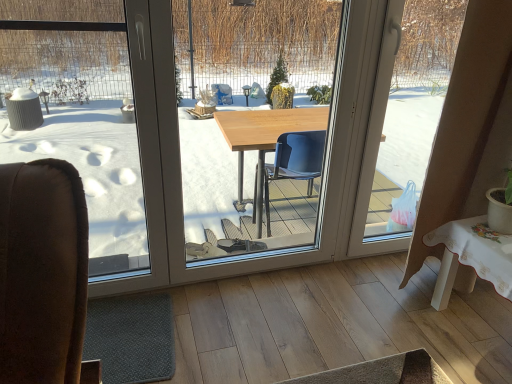
Describe the element at coordinates (78, 114) in the screenshot. This screenshot has height=384, width=512. I see `transparent glass window at left, the 1th window screen when ordered from left to right` at that location.

This screenshot has width=512, height=384. What are the coordinates of `gray rubber mat at lower left` in the screenshot? It's located at (131, 338).

Locate an element on the screen. The image size is (512, 384). transparent glass window at left, the 1th window screen when ordered from left to right is located at coordinates (78, 114).

Is gray rubber mat at lower left shorter than wooden table at center, acting as the second window screen starting from the left?

Yes, gray rubber mat at lower left is shorter than wooden table at center, acting as the second window screen starting from the left.

From a real-world perspective, is gray rubber mat at lower left below wooden table at center, acting as the second window screen starting from the left?

Yes, from a real-world perspective, gray rubber mat at lower left is beneath wooden table at center, acting as the second window screen starting from the left.

Is gray rubber mat at lower left surrounding wooden table at center, acting as the second window screen starting from the left?

No, wooden table at center, acting as the second window screen starting from the left, is not surrounded by gray rubber mat at lower left.

Considering the sizes of objects gray rubber mat at lower left and wooden table at center, arranged as the 2th window screen when viewed from the right, in the image provided, who is thinner, gray rubber mat at lower left or wooden table at center, arranged as the 2th window screen when viewed from the right,?

wooden table at center, arranged as the 2th window screen when viewed from the right.

Considering the positions of objects gray rubber mat at lower left and transparent plastic bag at right, which is the first window screen in right-to-left order, in the image provided, who is behind, gray rubber mat at lower left or transparent plastic bag at right, which is the first window screen in right-to-left order,?

transparent plastic bag at right, which is the first window screen in right-to-left order, is further away from the camera.

Who is bigger, gray rubber mat at lower left or transparent plastic bag at right, which is the first window screen in right-to-left order?

With larger size is transparent plastic bag at right, which is the first window screen in right-to-left order.

Which is more to the left, gray rubber mat at lower left or transparent plastic bag at right, the third window screen when ordered from left to right?

gray rubber mat at lower left.

From a real-world perspective, which object stands above the other?

transparent plastic bag at right, which is the first window screen in right-to-left order.

Based on the photo, how different are the orientations of transparent glass window at left, the 3th window screen positioned from the right, and wooden table at center, acting as the second window screen starting from the left, in degrees?

0.00145 degrees.

Looking at this image, between transparent glass window at left, the 1th window screen when ordered from left to right, and wooden table at center, arranged as the 2th window screen when viewed from the right, which one has larger width?

With larger width is transparent glass window at left, the 1th window screen when ordered from left to right.

From their relative heights in the image, would you say transparent glass window at left, the 1th window screen when ordered from left to right, is taller or shorter than wooden table at center, acting as the second window screen starting from the left?

Considering their sizes, transparent glass window at left, the 1th window screen when ordered from left to right, has less height than wooden table at center, acting as the second window screen starting from the left.

Is wooden table at center, arranged as the 2th window screen when viewed from the right, bigger or smaller than transparent plastic bag at right, the third window screen when ordered from left to right?

Clearly, wooden table at center, arranged as the 2th window screen when viewed from the right, is smaller in size than transparent plastic bag at right, the third window screen when ordered from left to right.

In the scene shown: From the image's perspective, which one is positioned lower, wooden table at center, arranged as the 2th window screen when viewed from the right, or transparent plastic bag at right, which is the first window screen in right-to-left order?

wooden table at center, arranged as the 2th window screen when viewed from the right.

Which of these two, wooden table at center, arranged as the 2th window screen when viewed from the right, or transparent plastic bag at right, the third window screen when ordered from left to right, is wider?

transparent plastic bag at right, the third window screen when ordered from left to right, is wider.

From a real-world perspective, is transparent plastic bag at right, which is the first window screen in right-to-left order, beneath transparent glass window at left, the 3th window screen positioned from the right?

No, from a real-world perspective, transparent plastic bag at right, which is the first window screen in right-to-left order, is not beneath transparent glass window at left, the 3th window screen positioned from the right.

Consider the image. Could you tell me if transparent plastic bag at right, which is the first window screen in right-to-left order, is facing transparent glass window at left, the 1th window screen when ordered from left to right?

No, transparent plastic bag at right, which is the first window screen in right-to-left order, is not aimed at transparent glass window at left, the 1th window screen when ordered from left to right.

Considering the sizes of objects transparent plastic bag at right, the third window screen when ordered from left to right, and transparent glass window at left, the 3th window screen positioned from the right, in the image provided, who is bigger, transparent plastic bag at right, the third window screen when ordered from left to right, or transparent glass window at left, the 3th window screen positioned from the right,?

With larger size is transparent glass window at left, the 3th window screen positioned from the right.

Can you confirm if transparent plastic bag at right, the third window screen when ordered from left to right, is shorter than transparent glass window at left, the 3th window screen positioned from the right?

No.

Could you tell me if wooden table at center, arranged as the 2th window screen when viewed from the right, is facing transparent glass window at left, the 1th window screen when ordered from left to right?

No.

Would you consider wooden table at center, arranged as the 2th window screen when viewed from the right, to be distant from transparent glass window at left, the 3th window screen positioned from the right?

Yes, wooden table at center, arranged as the 2th window screen when viewed from the right, is far from transparent glass window at left, the 3th window screen positioned from the right.

From a real-world perspective, between wooden table at center, acting as the second window screen starting from the left, and transparent glass window at left, the 3th window screen positioned from the right, who is vertically higher?

wooden table at center, acting as the second window screen starting from the left.

Can you confirm if transparent glass window at left, the 1th window screen when ordered from left to right, is shorter than gray rubber mat at lower left?

No, transparent glass window at left, the 1th window screen when ordered from left to right, is not shorter than gray rubber mat at lower left.

Is transparent glass window at left, the 3th window screen positioned from the right, wider than gray rubber mat at lower left?

Incorrect, the width of transparent glass window at left, the 3th window screen positioned from the right, does not surpass that of gray rubber mat at lower left.

Is transparent glass window at left, the 3th window screen positioned from the right, directly adjacent to gray rubber mat at lower left?

There is a gap between transparent glass window at left, the 3th window screen positioned from the right, and gray rubber mat at lower left.

Is transparent glass window at left, the 3th window screen positioned from the right, looking in the opposite direction of gray rubber mat at lower left?

transparent glass window at left, the 3th window screen positioned from the right, is not turned away from gray rubber mat at lower left.

Find the location of a particular element. the 1st window screen to the right of the gray rubber mat at lower left, counting from the anchor's position is located at coordinates pyautogui.click(x=249, y=120).

The height and width of the screenshot is (384, 512). What are the coordinates of `flat on the left of the transparent plastic bag at right, which is the first window screen in right-to-left order` in the screenshot? It's located at (131, 338).

From the image, which object appears to be nearer to wooden table at center, arranged as the 2th window screen when viewed from the right, transparent plastic bag at right, which is the first window screen in right-to-left order, or gray rubber mat at lower left?

transparent plastic bag at right, which is the first window screen in right-to-left order, is closer to wooden table at center, arranged as the 2th window screen when viewed from the right.

From the image, which object appears to be farther from transparent plastic bag at right, which is the first window screen in right-to-left order, transparent glass window at left, the 3th window screen positioned from the right, or wooden table at center, arranged as the 2th window screen when viewed from the right?

transparent glass window at left, the 3th window screen positioned from the right, is further to transparent plastic bag at right, which is the first window screen in right-to-left order.

In the scene shown: Looking at the image, which one is located closer to transparent plastic bag at right, which is the first window screen in right-to-left order, wooden table at center, acting as the second window screen starting from the left, or gray rubber mat at lower left?

wooden table at center, acting as the second window screen starting from the left.

Looking at the image, which one is located further to gray rubber mat at lower left, transparent glass window at left, the 1th window screen when ordered from left to right, or transparent plastic bag at right, which is the first window screen in right-to-left order?

transparent plastic bag at right, which is the first window screen in right-to-left order, lies further to gray rubber mat at lower left than the other object.

Which object lies further to the anchor point gray rubber mat at lower left, transparent plastic bag at right, which is the first window screen in right-to-left order, or wooden table at center, arranged as the 2th window screen when viewed from the right?

transparent plastic bag at right, which is the first window screen in right-to-left order.

Considering their positions, is transparent plastic bag at right, which is the first window screen in right-to-left order, positioned closer to wooden table at center, arranged as the 2th window screen when viewed from the right, than transparent glass window at left, the 1th window screen when ordered from left to right?

transparent glass window at left, the 1th window screen when ordered from left to right.

When comparing their distances from transparent plastic bag at right, which is the first window screen in right-to-left order, does wooden table at center, arranged as the 2th window screen when viewed from the right, or transparent glass window at left, the 1th window screen when ordered from left to right, seem further?

Among the two, transparent glass window at left, the 1th window screen when ordered from left to right, is located further to transparent plastic bag at right, which is the first window screen in right-to-left order.

From the image, which object appears to be nearer to gray rubber mat at lower left, transparent glass window at left, the 3th window screen positioned from the right, or wooden table at center, arranged as the 2th window screen when viewed from the right?

transparent glass window at left, the 3th window screen positioned from the right, lies closer to gray rubber mat at lower left than the other object.

The image size is (512, 384). Find the location of `window screen located between gray rubber mat at lower left and transparent plastic bag at right, which is the first window screen in right-to-left order, in the left-right direction`. window screen located between gray rubber mat at lower left and transparent plastic bag at right, which is the first window screen in right-to-left order, in the left-right direction is located at coordinates click(x=249, y=120).

At what (x,y) coordinates should I click in order to perform the action: click on window screen between wooden table at center, acting as the second window screen starting from the left, and gray rubber mat at lower left, in the vertical direction. Please return your answer as a coordinate pair (x, y). Looking at the image, I should click on (78, 114).

Where is `window screen located between transparent glass window at left, the 1th window screen when ordered from left to right, and transparent plastic bag at right, the third window screen when ordered from left to right, in the left-right direction`? window screen located between transparent glass window at left, the 1th window screen when ordered from left to right, and transparent plastic bag at right, the third window screen when ordered from left to right, in the left-right direction is located at coordinates (249, 120).

You are a GUI agent. You are given a task and a screenshot of the screen. Output one action in this format:
    pyautogui.click(x=<x>, y=<y>)
    Task: Click on the flat between transparent glass window at left, the 1th window screen when ordered from left to right, and transparent plastic bag at right, which is the first window screen in right-to-left order, from left to right
    The width and height of the screenshot is (512, 384).
    Given the screenshot: What is the action you would take?
    pyautogui.click(x=131, y=338)